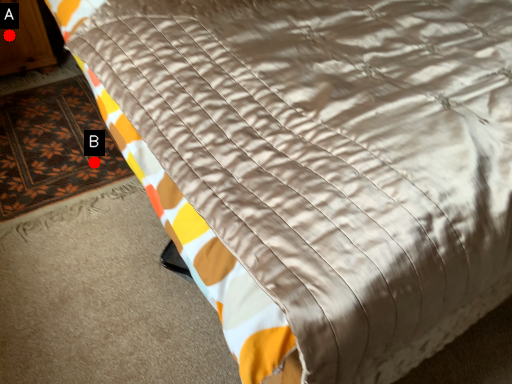
Question: Two points are circled on the image, labeled by A and B beside each circle. Which of the following is the closest to the observer?

Choices:
 (A) A is closer
 (B) B is closer

Answer: (B)